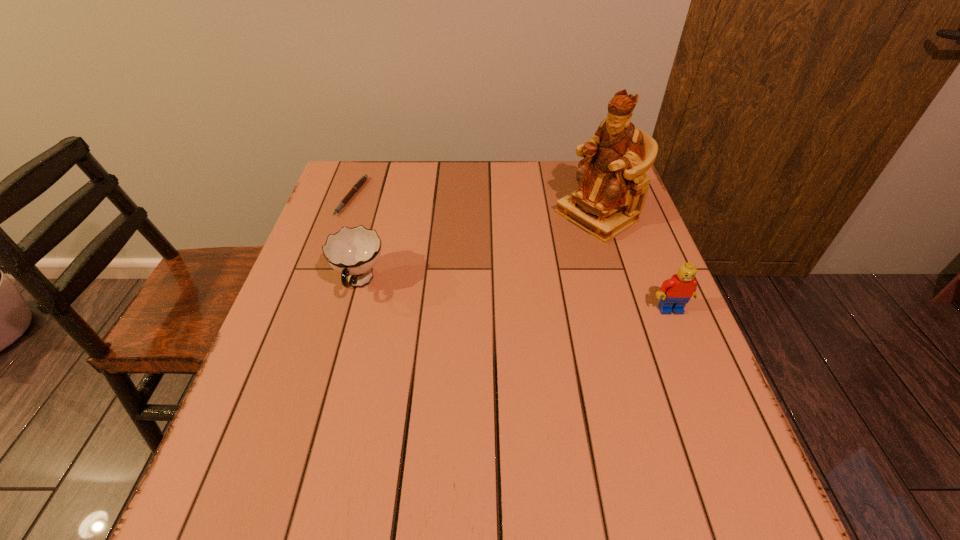
Image resolution: width=960 pixels, height=540 pixels. In order to click on the second shortest object in this screenshot , I will do `click(352, 252)`.

Locate an element on the screen. This screenshot has height=540, width=960. the third shortest object is located at coordinates (675, 292).

Find the location of a particular element. This screenshot has width=960, height=540. figurine is located at coordinates (612, 185).

The image size is (960, 540). I want to click on the shortest object, so click(x=360, y=182).

Identify the location of vacant space located 0.060m on the side of the cup with the handle. This screenshot has height=540, width=960. (347, 329).

I want to click on vacant area located on the face of the third shortest object, so click(x=686, y=348).

Image resolution: width=960 pixels, height=540 pixels. In order to click on free space located 0.340m on the front-facing side of the figurine in this screenshot , I will do `click(468, 291)`.

What are the coordinates of `free space located on the front-facing side of the figurine` in the screenshot? It's located at (518, 262).

You are a GUI agent. You are given a task and a screenshot of the screen. Output one action in this format:
    pyautogui.click(x=<x>, y=<y>)
    Task: Click on the vacant space located 0.270m on the front-facing side of the figurine
    The image size is (960, 540).
    Given the screenshot: What is the action you would take?
    tap(491, 278)

Image resolution: width=960 pixels, height=540 pixels. I want to click on blank space located 0.370m at the nib of the shortest object, so click(434, 282).